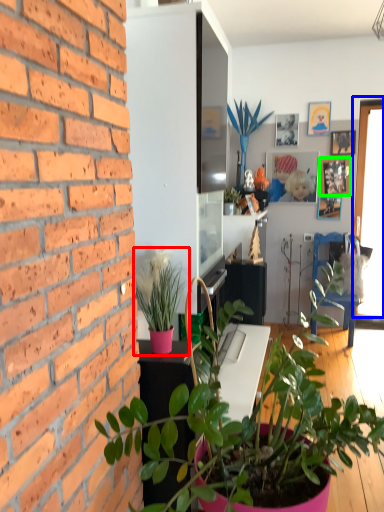
Question: Which object is positioned farthest from houseplant (highlighted by a red box)? Select from window (highlighted by a blue box) and picture frame (highlighted by a green box).

Choices:
 (A) window
 (B) picture frame

Answer: (B)